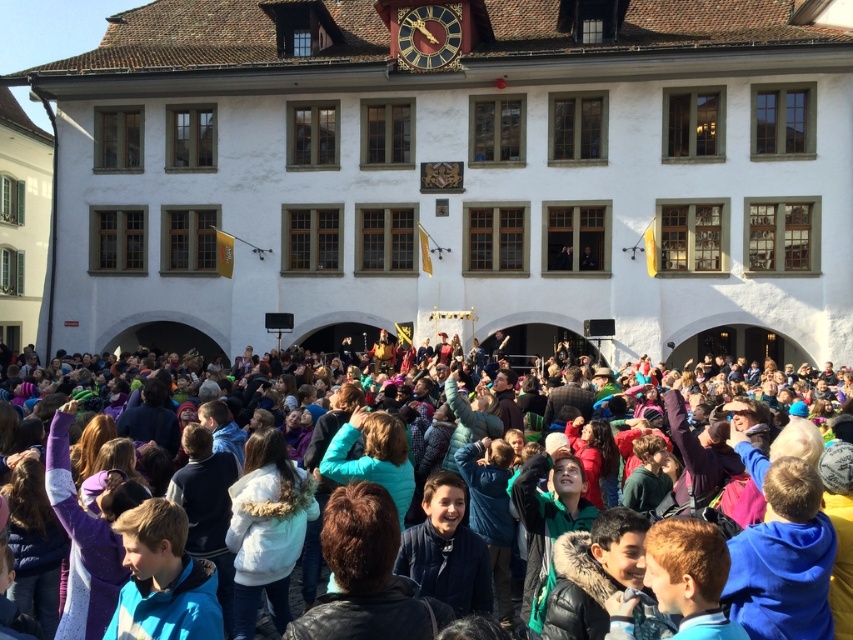
Question: Which object is farther from the camera taking this photo?

Choices:
 (A) multicolored clothing at center
 (B) gold-gilded wooden clock at upper center

Answer: (B)

Question: Considering the relative positions of multicolored clothing at center and gold-gilded wooden clock at upper center in the image provided, where is multicolored clothing at center located with respect to gold-gilded wooden clock at upper center?

Choices:
 (A) left
 (B) right

Answer: (A)

Question: Can you confirm if multicolored clothing at center is bigger than gold-gilded wooden clock at upper center?

Choices:
 (A) no
 (B) yes

Answer: (B)

Question: Among these points, which one is farthest from the camera?

Choices:
 (A) (428, 36)
 (B) (279, 612)

Answer: (A)

Question: In this image, where is multicolored clothing at center located relative to gold-gilded wooden clock at upper center?

Choices:
 (A) below
 (B) above

Answer: (A)

Question: Which point appears farthest from the camera in this image?

Choices:
 (A) (442, 32)
 (B) (210, 509)

Answer: (A)